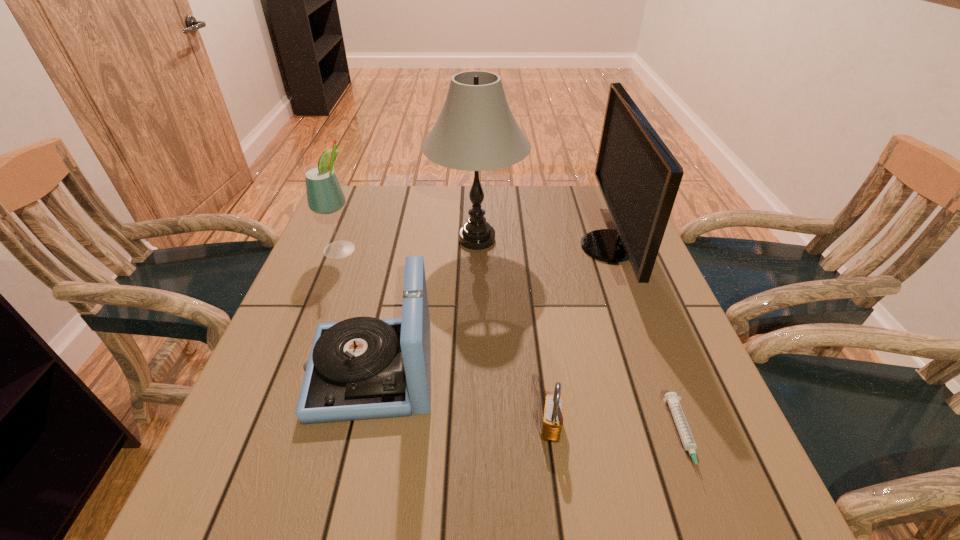
Identify the location of object that is the fourth closest one to the computer monitor. (362, 368).

I want to click on object that is the fourth closest to the alcohol, so click(552, 423).